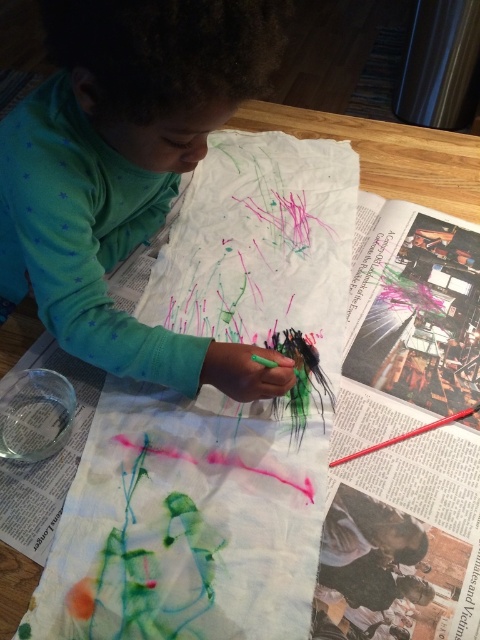
Question: Considering the relative positions of green matte shirt at upper left and smooth red crayon at center in the image provided, where is green matte shirt at upper left located with respect to smooth red crayon at center?

Choices:
 (A) below
 (B) above

Answer: (B)

Question: Which point is farther to the camera?

Choices:
 (A) smooth red crayon at center
 (B) green matte shirt at upper left

Answer: (A)

Question: Which point appears closest to the camera in this image?

Choices:
 (A) (3, 205)
 (B) (412, 433)

Answer: (B)

Question: Considering the relative positions of green matte shirt at upper left and smooth red crayon at center in the image provided, where is green matte shirt at upper left located with respect to smooth red crayon at center?

Choices:
 (A) above
 (B) below

Answer: (A)

Question: Is green matte shirt at upper left bigger than smooth red crayon at center?

Choices:
 (A) yes
 (B) no

Answer: (A)